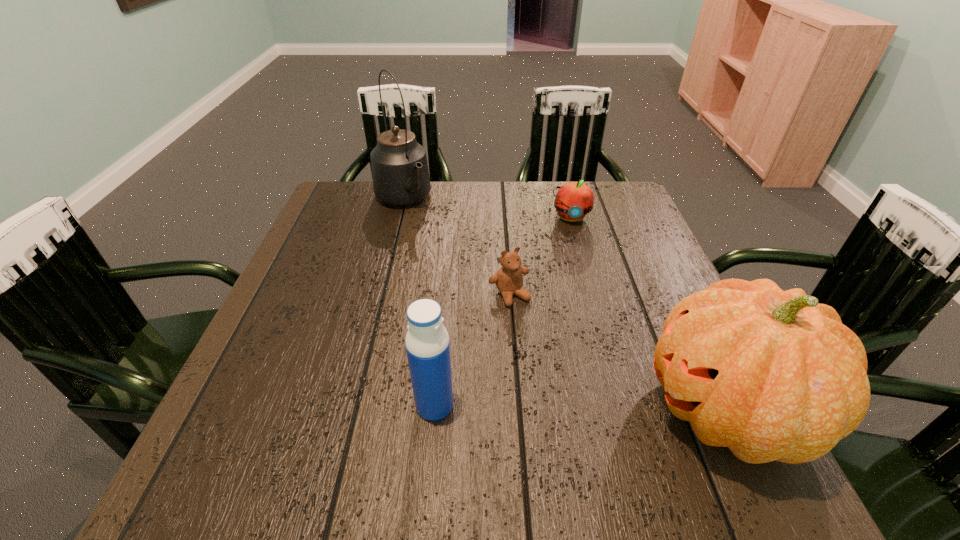
Where is `water bottle`? water bottle is located at coordinates (427, 343).

The height and width of the screenshot is (540, 960). What are the coordinates of `the second object from left to right` in the screenshot? It's located at (427, 343).

The image size is (960, 540). I want to click on the second tallest object, so click(x=772, y=375).

Find the location of a particular element. apple is located at coordinates (574, 200).

Where is `the third object from right to left`? This screenshot has height=540, width=960. the third object from right to left is located at coordinates (509, 279).

At what (x,y) coordinates should I click in order to perform the action: click on teddy bear. Please return your answer as a coordinate pair (x, y). Looking at the image, I should click on (509, 279).

Image resolution: width=960 pixels, height=540 pixels. In order to click on the leftmost object in this screenshot , I will do `click(400, 173)`.

Where is `the tallest object`? the tallest object is located at coordinates (400, 173).

At what (x,y) coordinates should I click in order to perform the action: click on vacant area situated 0.370m on the back of the third shortest object. Please return your answer as a coordinate pair (x, y). Image resolution: width=960 pixels, height=540 pixels. Looking at the image, I should click on (447, 261).

The height and width of the screenshot is (540, 960). I want to click on blank area located 0.260m on the carved face of the fourth shortest object, so click(496, 409).